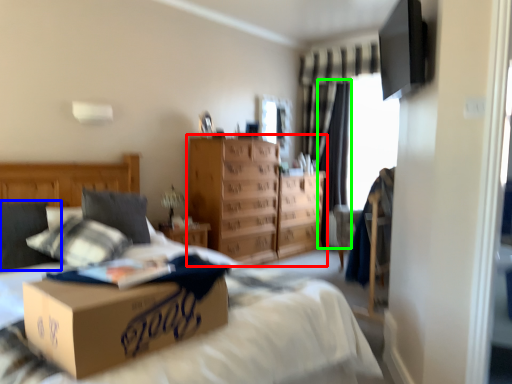
Question: Which object is positioned farthest from chest of drawers (highlighted by a red box)? Select from pillow (highlighted by a blue box) and curtain (highlighted by a green box).

Choices:
 (A) pillow
 (B) curtain

Answer: (A)